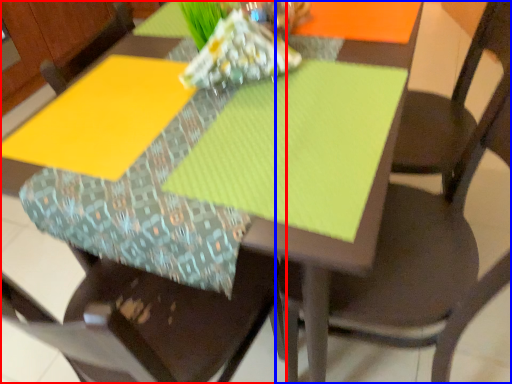
Question: Among these objects, which one is nearest to the camera, chair (highlighted by a red box) or chair (highlighted by a blue box)?

Choices:
 (A) chair
 (B) chair

Answer: (A)